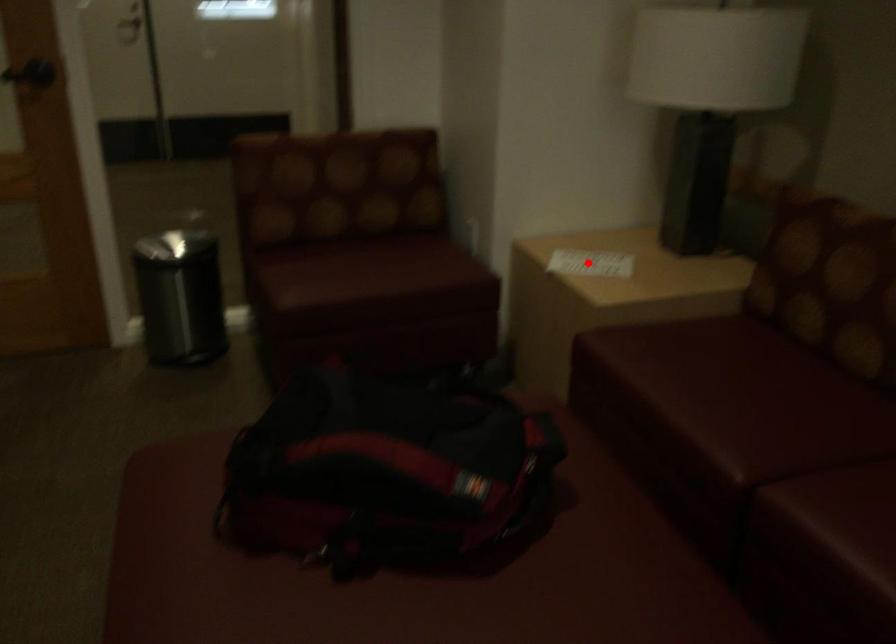
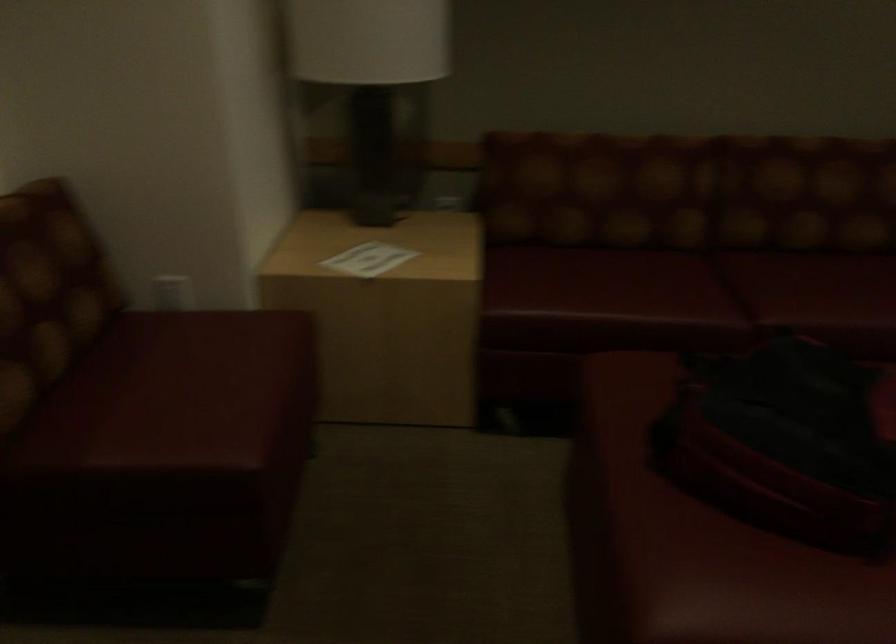
The point at the highlighted location is marked in the first image. Where is the corresponding point in the second image?

(367, 259)